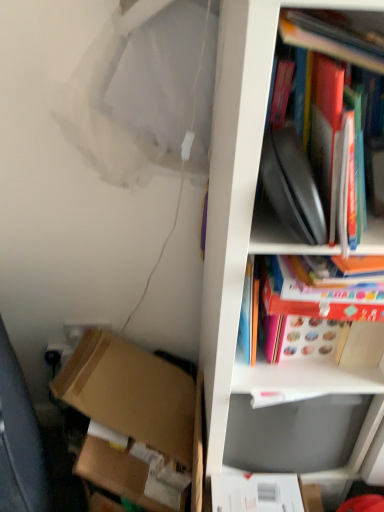
Question: From the image's perspective, is brown cardboard box at lower left over white matte cabinet at right?

Choices:
 (A) no
 (B) yes

Answer: (A)

Question: Is brown cardboard box at lower left positioned in front of white matte cabinet at right?

Choices:
 (A) no
 (B) yes

Answer: (A)

Question: Is brown cardboard box at lower left bigger than white matte cabinet at right?

Choices:
 (A) no
 (B) yes

Answer: (A)

Question: From a real-world perspective, is brown cardboard box at lower left below white matte cabinet at right?

Choices:
 (A) yes
 (B) no

Answer: (A)

Question: From a real-world perspective, is brown cardboard box at lower left positioned over white matte cabinet at right based on gravity?

Choices:
 (A) yes
 (B) no

Answer: (B)

Question: Is brown cardboard box at lower left to the right of white matte cabinet at right from the viewer's perspective?

Choices:
 (A) no
 (B) yes

Answer: (A)

Question: Can you confirm if hardcover book at upper right, arranged as the 2th book when ordered from the bottom, is positioned to the left of white matte cabinet at right?

Choices:
 (A) yes
 (B) no

Answer: (A)

Question: From the image's perspective, is hardcover book at upper right, positioned as the first book in top-to-bottom order, under white matte cabinet at right?

Choices:
 (A) yes
 (B) no

Answer: (B)

Question: Would you say hardcover book at upper right, positioned as the first book in top-to-bottom order, contains white matte cabinet at right?

Choices:
 (A) no
 (B) yes

Answer: (A)

Question: Does hardcover book at upper right, positioned as the first book in top-to-bottom order, have a greater width compared to white matte cabinet at right?

Choices:
 (A) no
 (B) yes

Answer: (A)

Question: Is the depth of hardcover book at upper right, positioned as the first book in top-to-bottom order, less than that of white matte cabinet at right?

Choices:
 (A) yes
 (B) no

Answer: (B)

Question: Considering the relative sizes of hardcover book at upper right, arranged as the 2th book when ordered from the bottom, and white matte cabinet at right in the image provided, is hardcover book at upper right, arranged as the 2th book when ordered from the bottom, taller than white matte cabinet at right?

Choices:
 (A) yes
 (B) no

Answer: (B)

Question: From the image's perspective, is matte red book at upper right, the 2th book positioned from the top, on brown cardboard box at lower left?

Choices:
 (A) no
 (B) yes

Answer: (B)